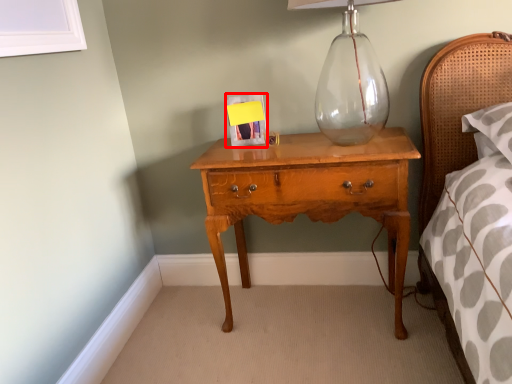
Question: From the image's perspective, where is picture frame (annotated by the red box) located in relation to nightstand in the image?

Choices:
 (A) below
 (B) above

Answer: (B)